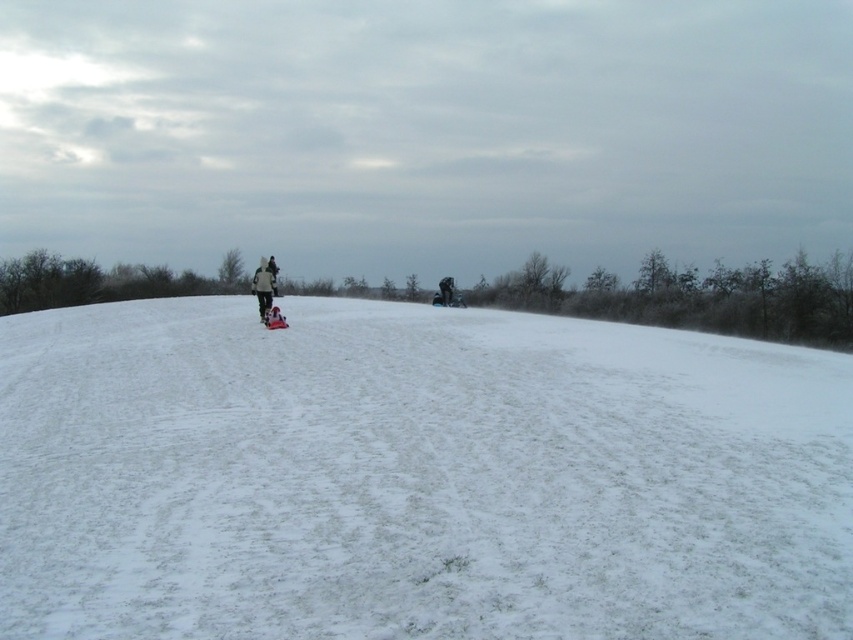
Question: Is white fluffy snow at center positioned before dark gray fleece jacket at center?

Choices:
 (A) no
 (B) yes

Answer: (B)

Question: Is white fluffy snow at center bigger than dark gray fleece jacket at center?

Choices:
 (A) no
 (B) yes

Answer: (A)

Question: Can you confirm if white fluffy snow at center is positioned to the left of dark gray fleece jacket at center?

Choices:
 (A) no
 (B) yes

Answer: (A)